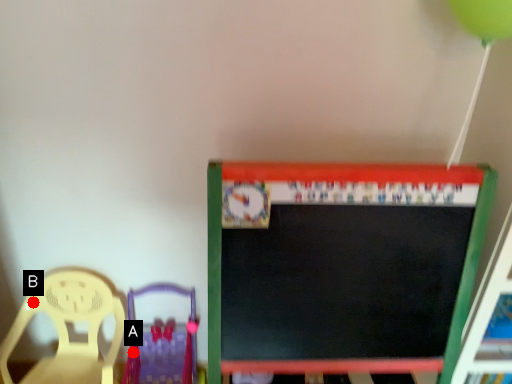
Question: Two points are circled on the image, labeled by A and B beside each circle. Which point appears closest to the camera in this image?

Choices:
 (A) A is closer
 (B) B is closer

Answer: (B)